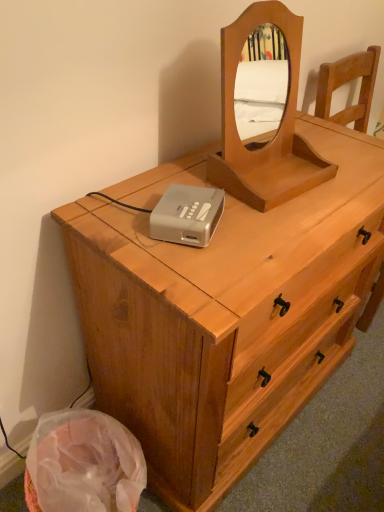
Identify the location of vacant area that is in front of light brown wooden mirror at upper center. The width and height of the screenshot is (384, 512). (281, 229).